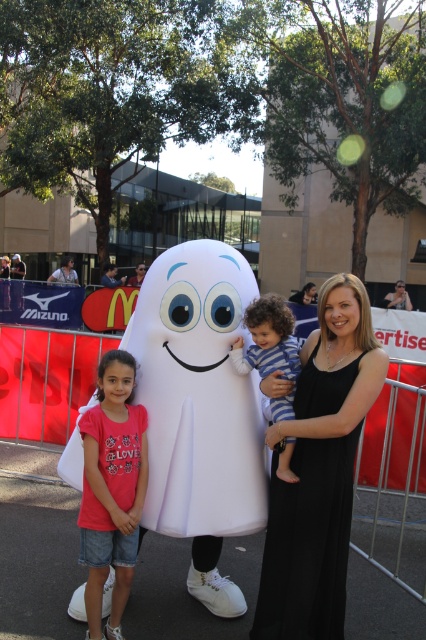
In the scene shown: You are a photographer setting up for a group photo. You need to arrange the black satin dress at center and the matte pink shirt at left so that both are visible in the frame. Given their height difference, which one should you position closer to the camera to ensure both are fully visible?

The black satin dress at center is taller than the matte pink shirt at left. To ensure both are fully visible, position the shorter matte pink shirt at left closer to the camera so that the taller black satin dress at center doesn

You are standing in the scene and want to place a small gift exactly where the black satin dress at center is located. What are the coordinates you should aim for?

You should aim for the coordinates point (307, 541) where the black satin dress at center is located.

You are a photographer trying to capture a group photo. You notice two people in the center wearing different outfits. The outfits are labeled as black satin dress at center and blue striped pajamas at center. Which outfit is positioned to the right of the other?

The black satin dress at center is positioned to the right of the blue striped pajamas at center.